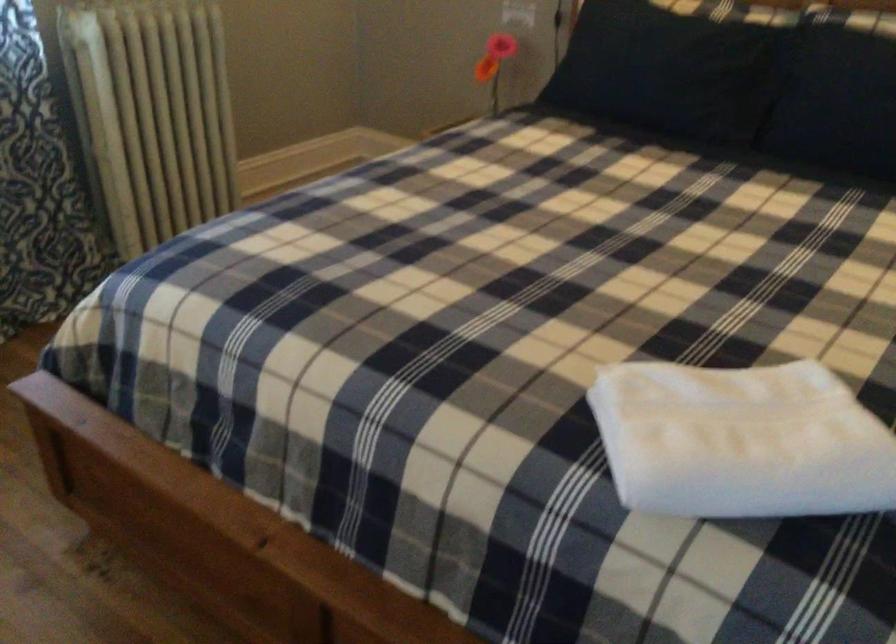
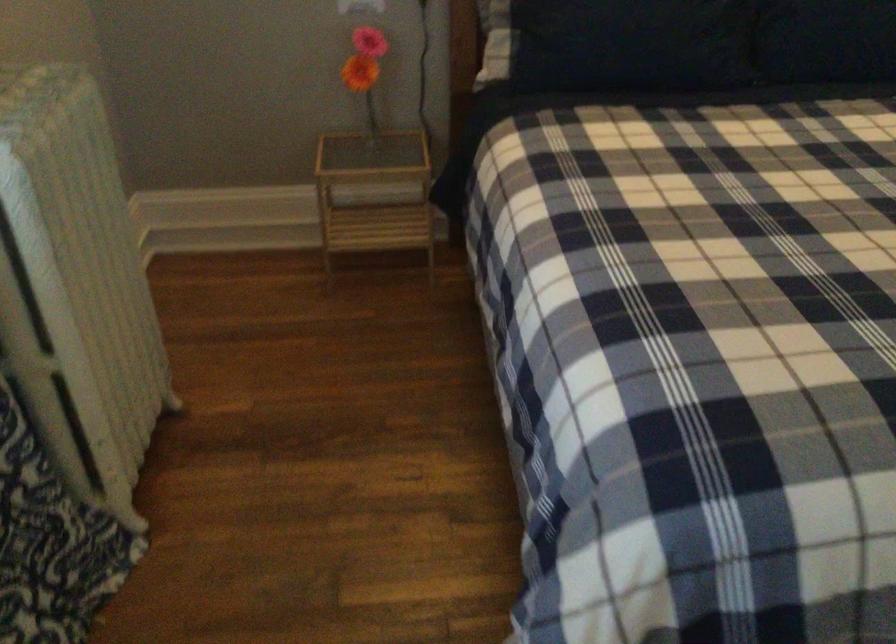
The point at (630,80) is marked in the first image. Where is the corresponding point in the second image?

(631, 44)